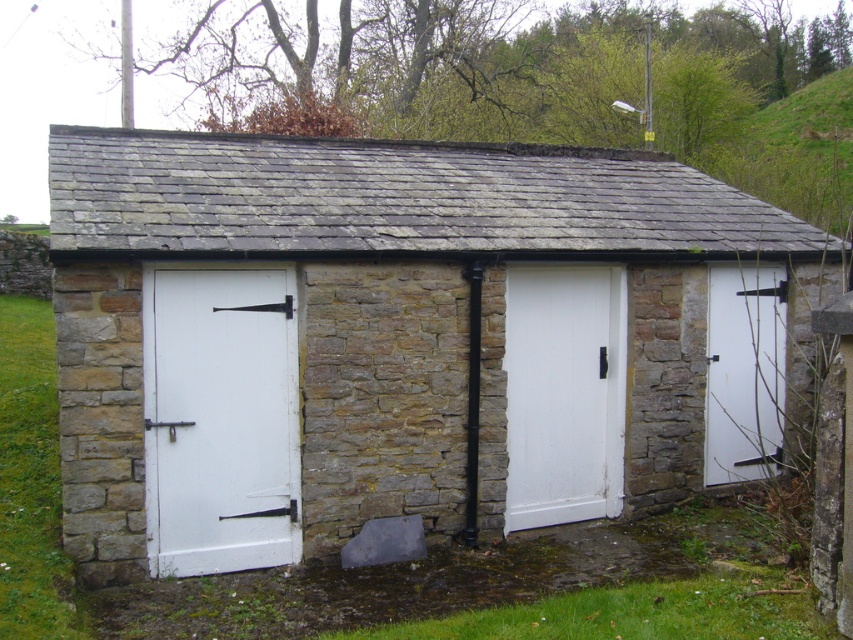
Question: Estimate the real-world distances between objects in this image. Which object is closer to the white painted wood door at center?

Choices:
 (A) white painted wood door at left
 (B) white smooth door at center
 (C) white matte door at right

Answer: (B)

Question: Can you confirm if white painted wood door at center is positioned below white matte door at right?

Choices:
 (A) yes
 (B) no

Answer: (B)

Question: Is the position of white painted wood door at center less distant than that of white matte door at right?

Choices:
 (A) no
 (B) yes

Answer: (B)

Question: Does white painted wood door at center appear under white smooth door at center?

Choices:
 (A) yes
 (B) no

Answer: (B)

Question: Which point is closer to the camera?

Choices:
 (A) (351, 244)
 (B) (561, 481)

Answer: (A)

Question: Among these points, which one is nearest to the camera?

Choices:
 (A) (108, 536)
 (B) (210, 522)

Answer: (A)